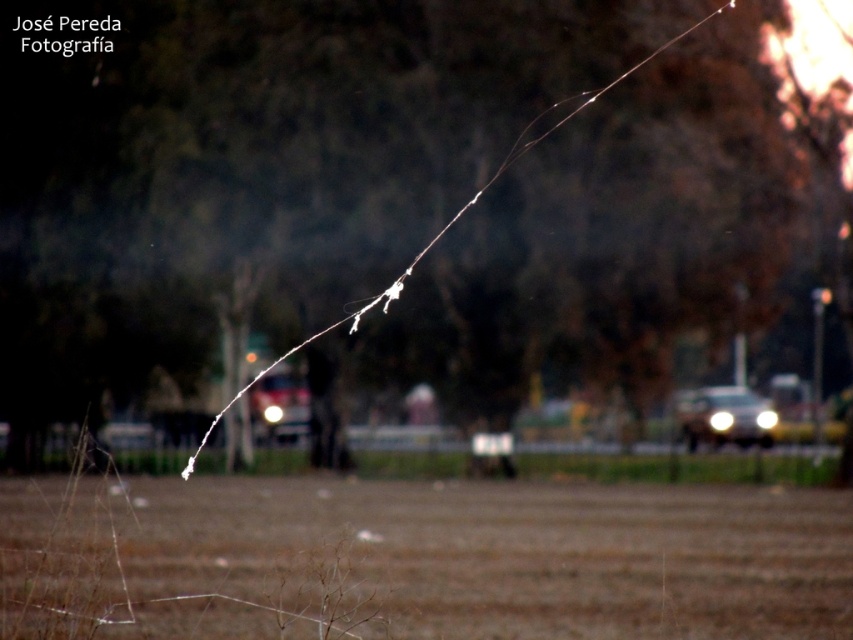
You are standing at the bottom left corner of the image and want to walk to the brown soil at center. Which direction should you move in relation to the spider web stretching diagonally from the bottom left to the upper right?

The brown soil at center is located at point (x=485, y=557), so you should move towards the upper right direction, following the spider web stretching diagonally from the bottom left to the upper right.

You are a photographer trying to capture the brown soil at center and the shiny silver car at right in a single frame. Which object will occupy more space in your photo?

The brown soil at center occupies more space in the photo because it is bigger than the shiny silver car at right according to the description.